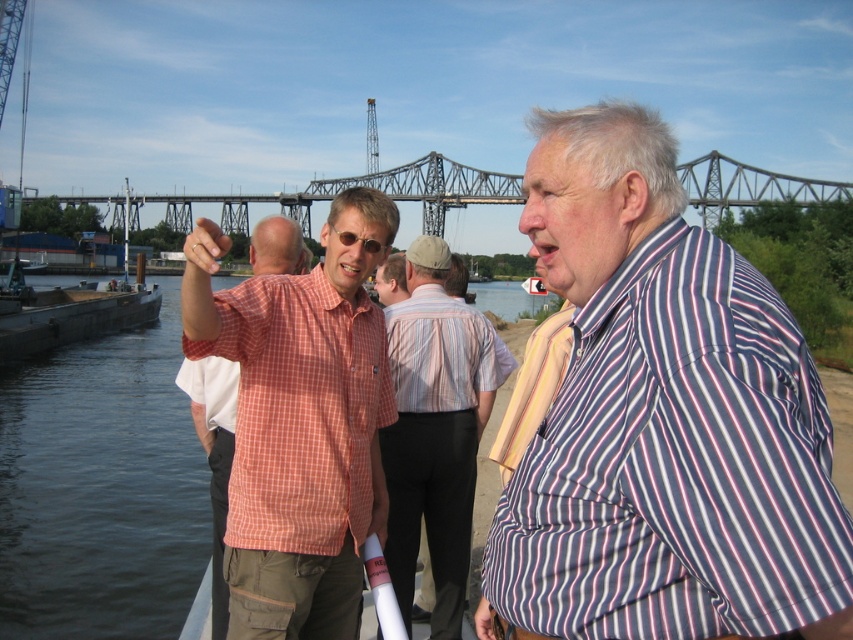
Question: Which of the following is the closest to the observer?

Choices:
 (A) (776, 193)
 (B) (650, 195)
 (C) (196, 256)

Answer: (B)

Question: Does checkered fabric shirt at center appear on the left side of metallic gray bridge at upper center?

Choices:
 (A) no
 (B) yes

Answer: (B)

Question: Which object is farther from the camera taking this photo?

Choices:
 (A) checkered fabric shirt at center
 (B) metallic gray bridge at upper center
 (C) striped cotton shirt at right
 (D) striped cotton shirt at center

Answer: (B)

Question: Which object is closer to the camera taking this photo?

Choices:
 (A) striped cotton shirt at right
 (B) striped cotton shirt at center

Answer: (A)

Question: From the image, what is the correct spatial relationship of striped cotton shirt at right in relation to striped cotton shirt at center?

Choices:
 (A) right
 (B) left

Answer: (A)

Question: Is striped cotton shirt at center to the right of metallic gray bridge at upper center from the viewer's perspective?

Choices:
 (A) yes
 (B) no

Answer: (A)